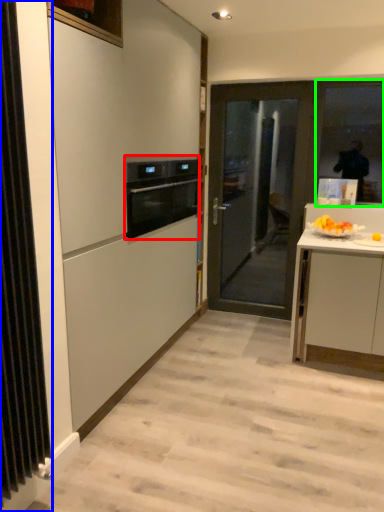
Question: Estimate the real-world distances between objects in this image. Which object is closer to kitchen appliance (highlighted by a red box), radiator (highlighted by a blue box) or window (highlighted by a green box)?

Choices:
 (A) radiator
 (B) window

Answer: (A)